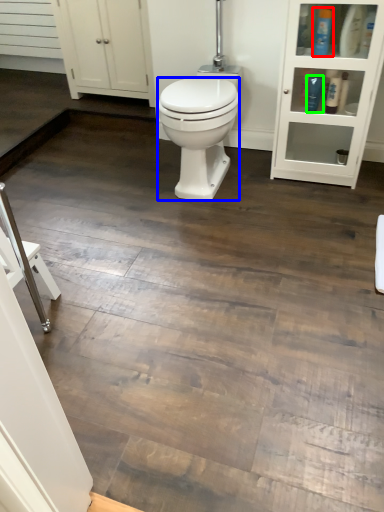
Question: Which object is positioned closest to toiletry (highlighted by a red box)? Select from bidet (highlighted by a blue box) and toiletry (highlighted by a green box).

Choices:
 (A) bidet
 (B) toiletry

Answer: (B)